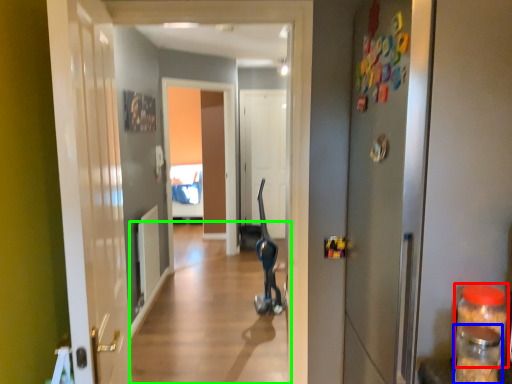
Question: Which is farther away from bottle (highlighted by a red box)? bottle (highlighted by a blue box) or alley (highlighted by a green box)?

Choices:
 (A) bottle
 (B) alley

Answer: (B)